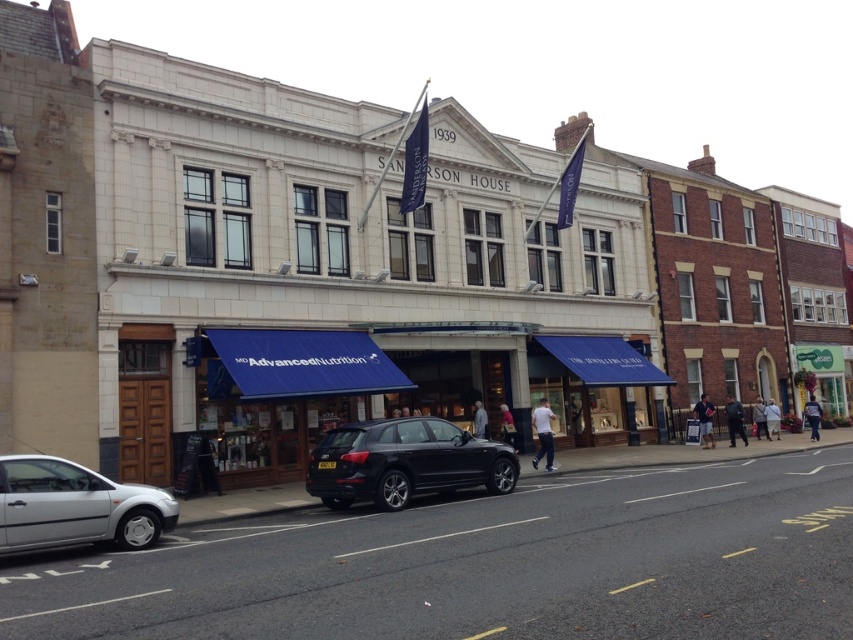
Can you confirm if white cotton t-shirt at center is thinner than pink fabric bag at center?

Yes, white cotton t-shirt at center is thinner than pink fabric bag at center.

Describe the element at coordinates (543, 433) in the screenshot. I see `white cotton t-shirt at center` at that location.

Where is `white cotton t-shirt at center`? This screenshot has height=640, width=853. white cotton t-shirt at center is located at coordinates (543, 433).

Does point (757, 435) come behind point (506, 417)?

Yes, point (757, 435) is behind point (506, 417).

Who is positioned more to the left, light brown leather jacket at center or pink fabric bag at center?

pink fabric bag at center

Is point (759, 404) positioned before point (503, 424)?

No, (759, 404) is further to viewer.

At what (x,y) coordinates should I click in order to perform the action: click on light brown leather jacket at center. Please return your answer as a coordinate pair (x, y). Looking at the image, I should click on (759, 417).

Is point (369, 435) positioned in front of point (485, 436)?

Yes, it is.

In the scene shown: Is black metallic car at center taller than light blue denim jacket at center?

Indeed, black metallic car at center has a greater height compared to light blue denim jacket at center.

Who is more distant from viewer, (465, 445) or (485, 410)?

The point (485, 410) is behind.

The width and height of the screenshot is (853, 640). Find the location of `black metallic car at center`. black metallic car at center is located at coordinates (404, 461).